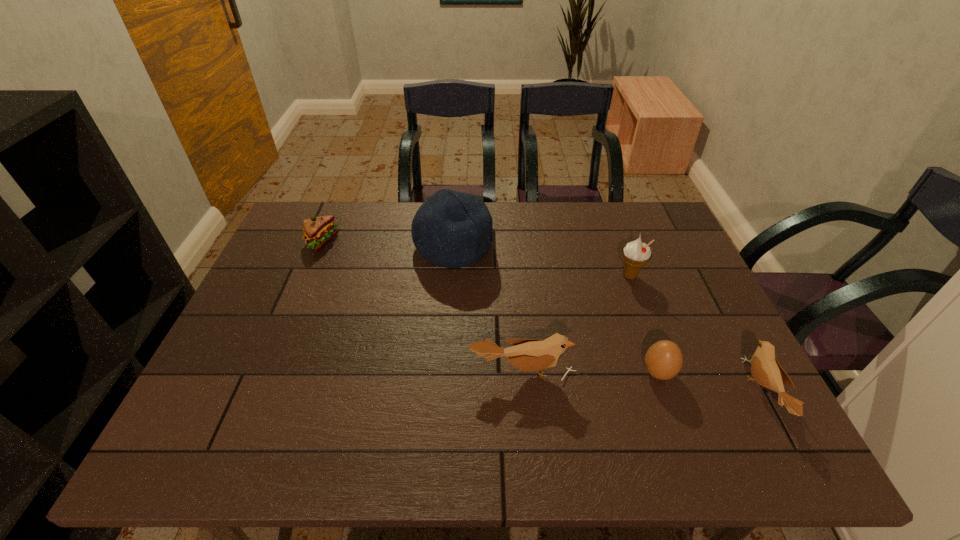
Where is `vacant space located 0.090m on the back of the tallest object`? vacant space located 0.090m on the back of the tallest object is located at coordinates (456, 207).

The height and width of the screenshot is (540, 960). I want to click on vacant space positioned on the left of the boiled egg, so click(560, 373).

The image size is (960, 540). Find the location of `sandwich that is at the far edge`. sandwich that is at the far edge is located at coordinates (318, 231).

This screenshot has width=960, height=540. I want to click on skullcap that is at the far edge, so click(451, 229).

At what (x,y) coordinates should I click in order to perform the action: click on boiled egg located at the near edge. Please return your answer as a coordinate pair (x, y). The image size is (960, 540). Looking at the image, I should click on (663, 360).

You are a GUI agent. You are given a task and a screenshot of the screen. Output one action in this format:
    pyautogui.click(x=<x>, y=<y>)
    Task: Click on the object positioned at the left edge
    
    Given the screenshot: What is the action you would take?
    pyautogui.click(x=318, y=231)

Where is `bird present at the right edge`? bird present at the right edge is located at coordinates (765, 368).

Where is `icecream positioned at the right edge`? This screenshot has height=540, width=960. icecream positioned at the right edge is located at coordinates (635, 254).

This screenshot has height=540, width=960. I want to click on object present at the far left corner, so click(x=318, y=231).

At what (x,y) coordinates should I click in order to perform the action: click on object positioned at the near right corner. Please return your answer as a coordinate pair (x, y). This screenshot has height=540, width=960. Looking at the image, I should click on (765, 368).